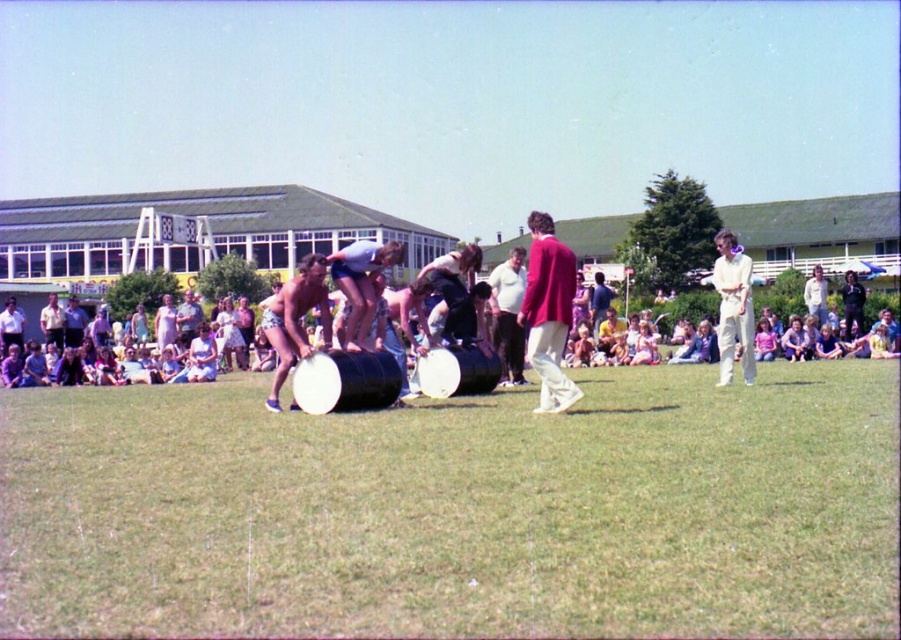
Question: Among these objects, which one is farthest from the camera?

Choices:
 (A) white cotton shirt at right
 (B) shiny metallic drum at center
 (C) light blue denim shirt at center
 (D) black matte barrel at center

Answer: (C)

Question: Among these points, which one is farthest from the camera?

Choices:
 (A) (721, 349)
 (B) (339, 336)

Answer: (A)

Question: Which object is farther from the camera taking this photo?

Choices:
 (A) smooth skin at center
 (B) white cotton shirt at right
 (C) smooth black drum at center
 (D) black matte barrel at center

Answer: (B)

Question: Does green grass at lower center appear on the right side of smooth skin at center?

Choices:
 (A) no
 (B) yes

Answer: (B)

Question: Does maroon fabric jacket at center come behind white cotton shirt at right?

Choices:
 (A) yes
 (B) no

Answer: (B)

Question: Is maroon fabric jacket at center to the right of light blue denim shirt at center from the viewer's perspective?

Choices:
 (A) no
 (B) yes

Answer: (A)